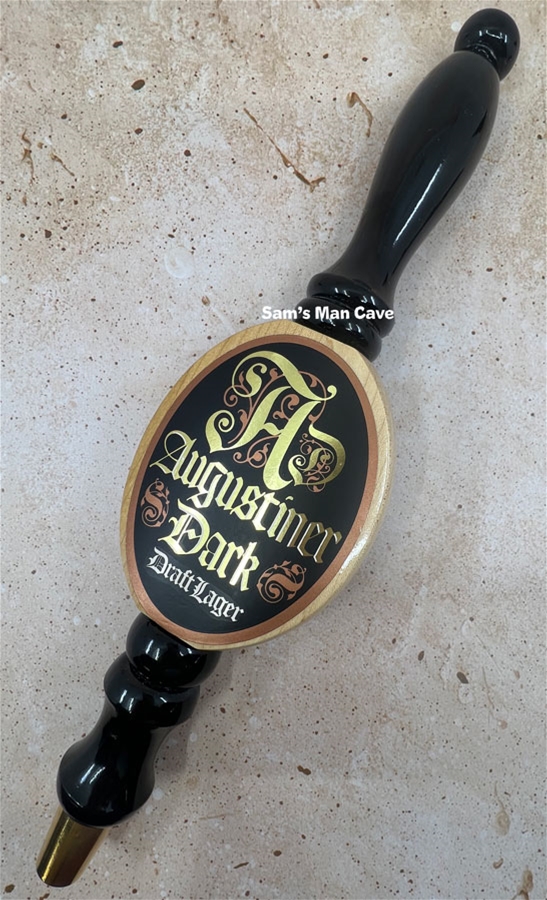
Locate an element on the screen. surface is located at coordinates (447, 652).